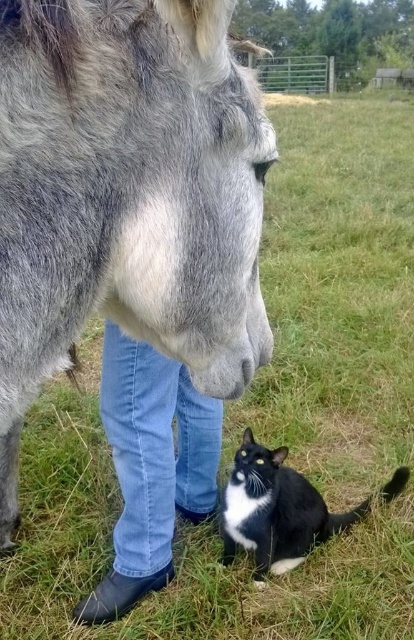
Question: Which point is farther from the camera taking this photo?

Choices:
 (A) (230, 561)
 (B) (158, 532)

Answer: (A)

Question: Which point appears farthest from the camera in this image?

Choices:
 (A) (214, 502)
 (B) (248, 524)

Answer: (A)

Question: Observing the image, what is the correct spatial positioning of blue jeans at lower center in reference to black glossy fur cat at lower right?

Choices:
 (A) left
 (B) right

Answer: (A)

Question: From the image, what is the correct spatial relationship of blue jeans at lower center in relation to black glossy fur cat at lower right?

Choices:
 (A) above
 (B) below

Answer: (A)

Question: Does blue jeans at lower center have a larger size compared to black glossy fur cat at lower right?

Choices:
 (A) yes
 (B) no

Answer: (A)